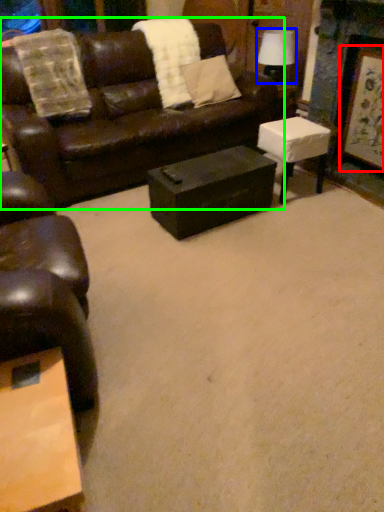
Question: Estimate the real-world distances between objects in this image. Which object is closer to picture frame (highlighted by a red box), lamp (highlighted by a blue box) or studio couch (highlighted by a green box)?

Choices:
 (A) lamp
 (B) studio couch

Answer: (A)